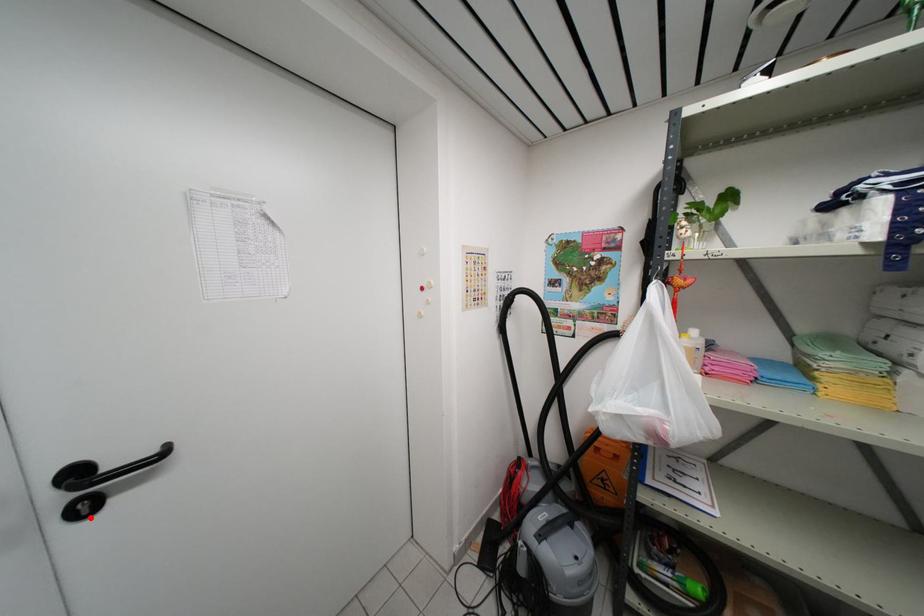
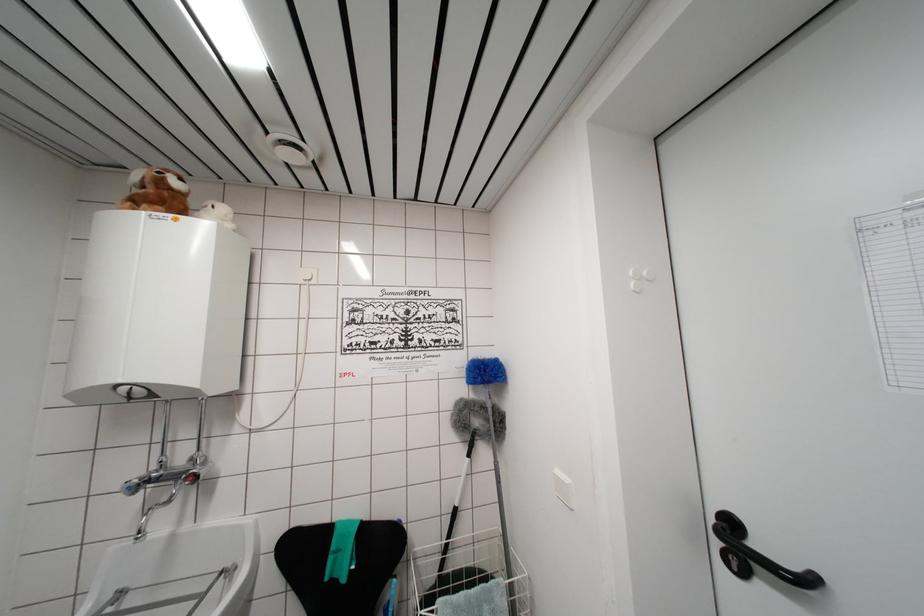
Question: I am providing you with two images of the same scene from different viewpoints. Given a red point in image1, look at the same physical point in image2. Is it:

Choices:
 (A) Closer to the viewpoint
 (B) Farther from the viewpoint

Answer: (B)